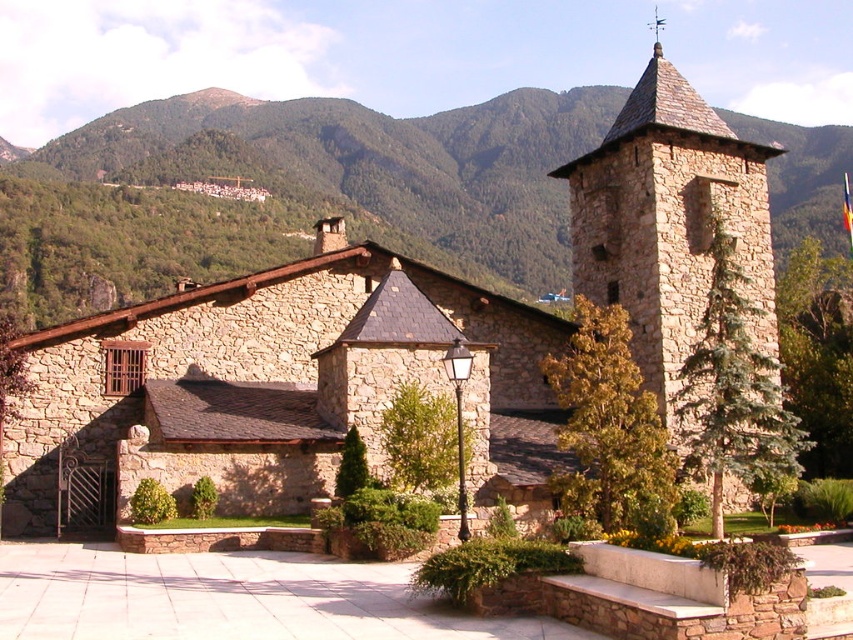
You are standing in front of the stone building and want to take a photo that includes both the green leafy hillside at upper left and the stone steeple at upper right. Given their sizes, which object should you frame first to ensure both are visible in the photo?

The green leafy hillside at upper left is larger in size than the stone steeple at upper right, so you should frame the green leafy hillside at upper left first to ensure both fit into the photo.